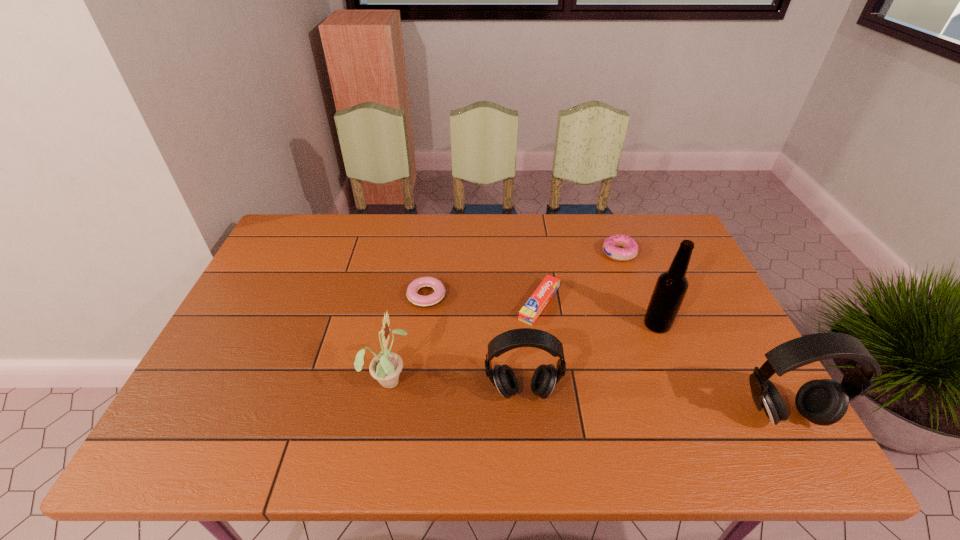
This screenshot has width=960, height=540. In order to click on the shorter earphone in this screenshot , I will do `click(545, 377)`.

Locate an element on the screen. the rightmost object is located at coordinates (823, 402).

This screenshot has height=540, width=960. Find the location of `the taller earphone`. the taller earphone is located at coordinates (823, 402).

The width and height of the screenshot is (960, 540). Find the location of `the farthest object`. the farthest object is located at coordinates (x=629, y=248).

At what (x,y) coordinates should I click in order to perform the action: click on the fifth tallest object. Please return your answer as a coordinate pair (x, y). This screenshot has width=960, height=540. Looking at the image, I should click on (629, 248).

At what (x,y) coordinates should I click in order to perform the action: click on the left doughnut. Please return your answer as a coordinate pair (x, y). This screenshot has width=960, height=540. Looking at the image, I should click on (433, 299).

Where is `the nearer doughnut`? the nearer doughnut is located at coordinates (433, 299).

Locate an element on the screen. beer bottle is located at coordinates point(670,289).

Locate an element on the screen. The image size is (960, 540). sunflower is located at coordinates (385, 367).

I want to click on toothpaste, so click(x=528, y=314).